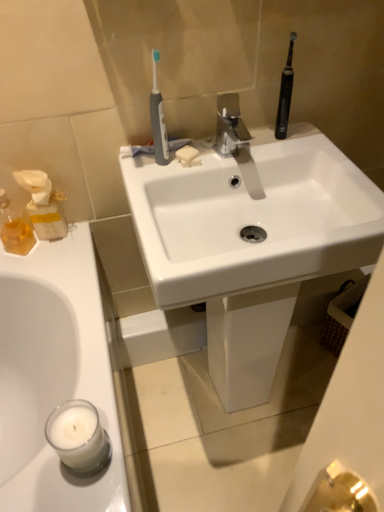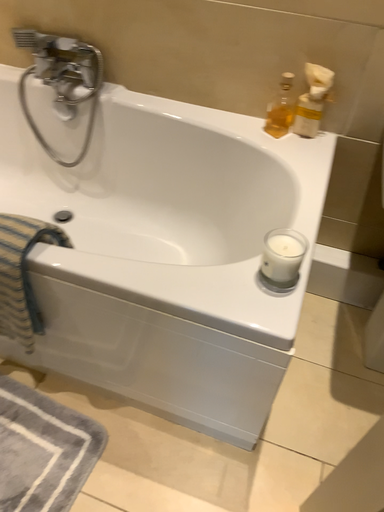
Question: How did the camera likely rotate when shooting the video?

Choices:
 (A) rotated right
 (B) rotated left

Answer: (B)